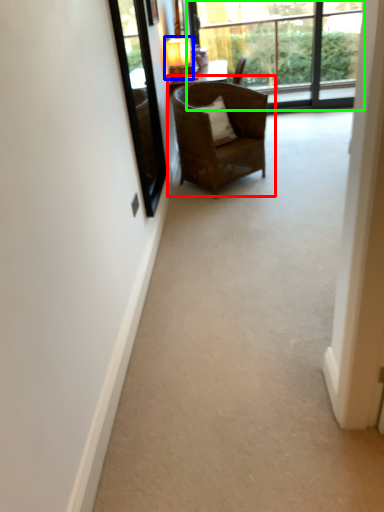
Question: Considering the real-world distances, which object is closest to chair (highlighted by a red box)? lamp (highlighted by a blue box) or window (highlighted by a green box).

Choices:
 (A) lamp
 (B) window

Answer: (A)